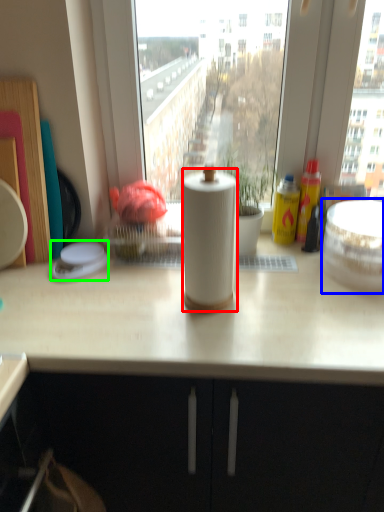
Question: Based on their relative distances, which object is farther from paper towel (highlighted by a red box)? Choose from appliance (highlighted by a blue box) and appliance (highlighted by a green box).

Choices:
 (A) appliance
 (B) appliance

Answer: (B)